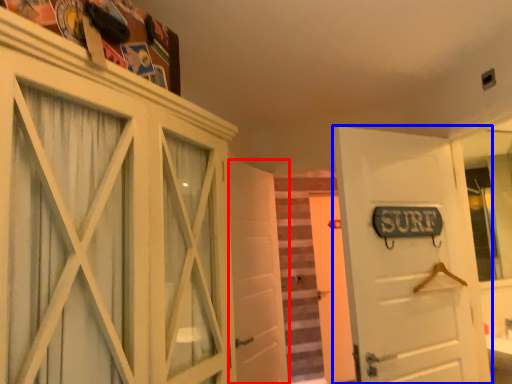
Question: Among these objects, which one is nearest to the camera, door (highlighted by a red box) or door (highlighted by a blue box)?

Choices:
 (A) door
 (B) door

Answer: (B)